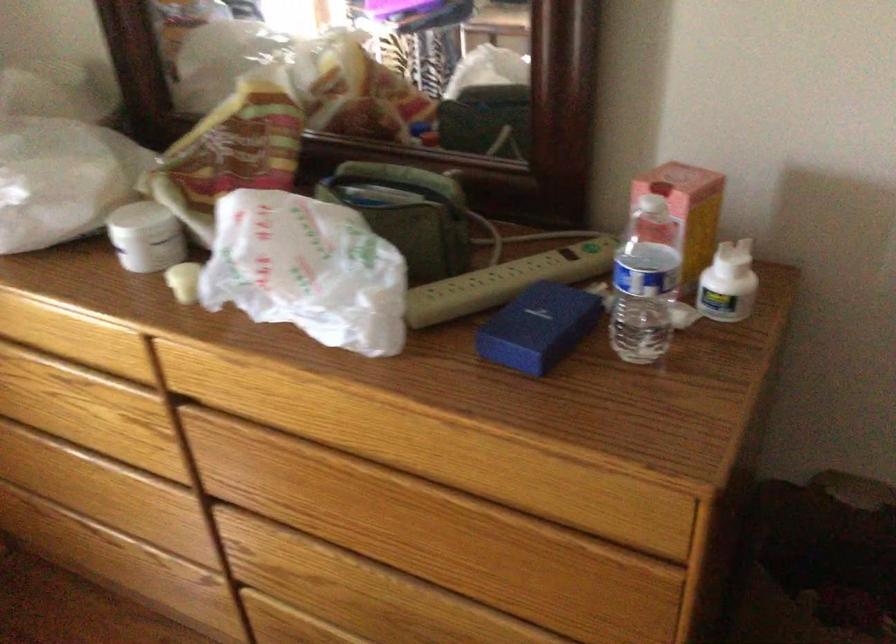
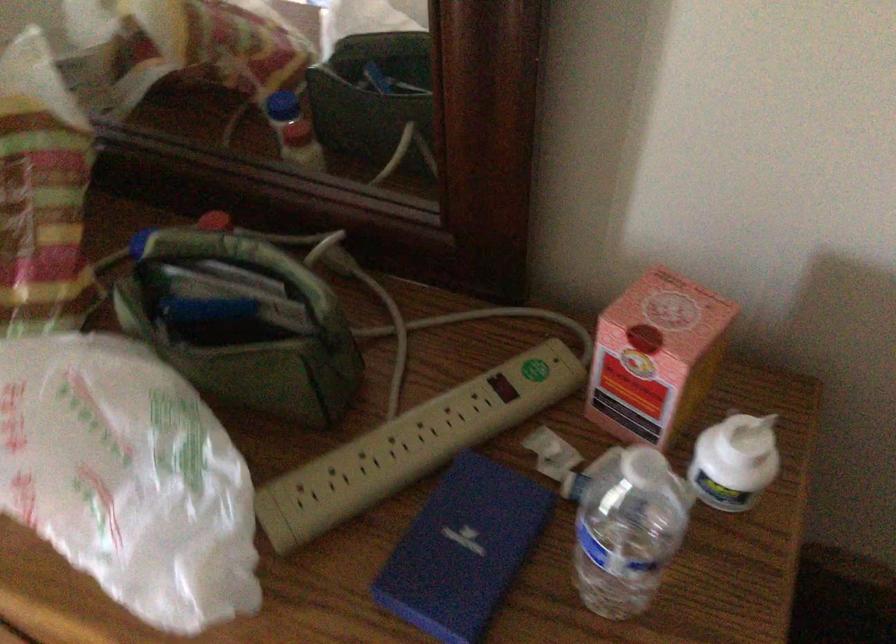
Where in the second image is the point corresponding to the point at 737,258 from the first image?

(754, 435)